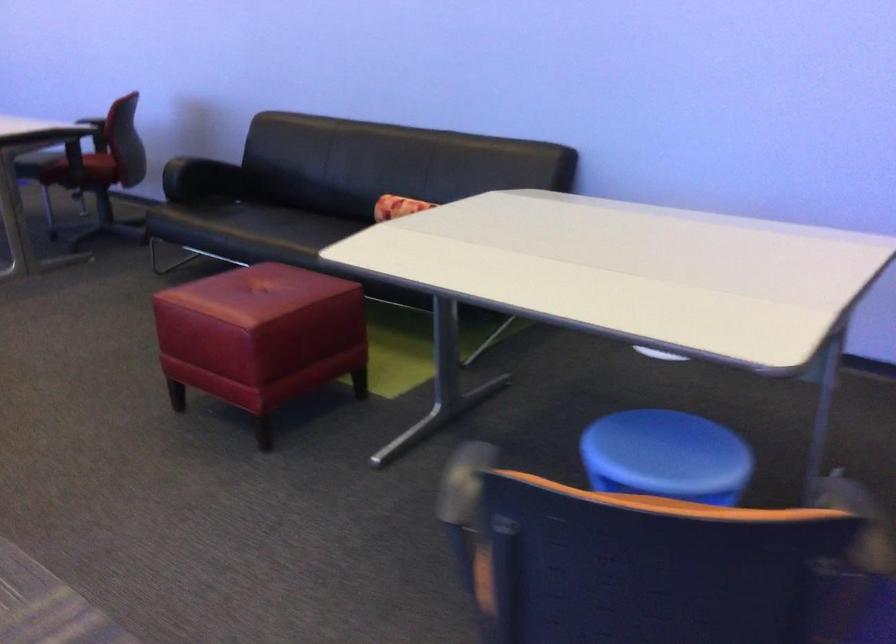
Locate an element on the screen. red chair sitting surface is located at coordinates (260, 292).